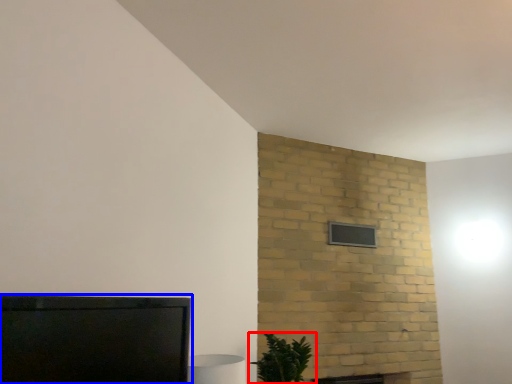
Question: Which object appears farthest to the camera in this image, houseplant (highlighted by a red box) or furniture (highlighted by a blue box)?

Choices:
 (A) houseplant
 (B) furniture

Answer: (A)